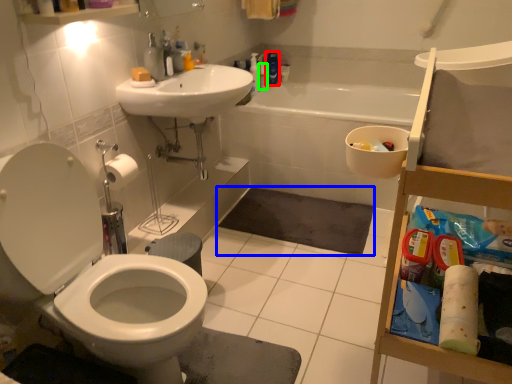
Question: Considering the real-world distances, which object is farthest from cleaning product (highlighted by a red box)? bath mat (highlighted by a blue box) or toiletry (highlighted by a green box)?

Choices:
 (A) bath mat
 (B) toiletry

Answer: (A)